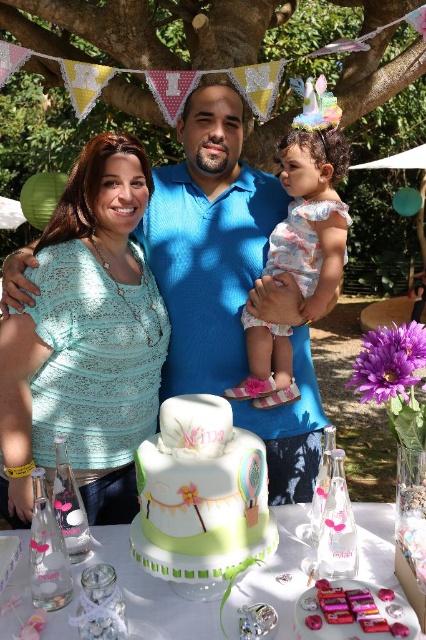
Which is below, blue textured shirt at center or floral fabric dress at center?

blue textured shirt at center is below.

Describe the element at coordinates (229, 282) in the screenshot. I see `blue textured shirt at center` at that location.

The height and width of the screenshot is (640, 426). I want to click on blue textured shirt at center, so click(229, 282).

Locate an element on the screen. blue textured shirt at center is located at coordinates (229, 282).

Does point (244, 528) come closer to viewer compared to point (317, 266)?

That is True.

Who is taller, white fondant cake at center or floral fabric dress at center?

floral fabric dress at center

Where is `white fondant cake at center`? white fondant cake at center is located at coordinates click(201, 496).

Is point (129, 212) more distant than point (331, 97)?

That is True.

Does light blue lace shirt at center come in front of floral fabric dress at center?

Yes.

Is point (66, 308) farther from viewer compared to point (287, 352)?

No.

Identify the location of light blue lace shirt at center. The height and width of the screenshot is (640, 426). (85, 333).